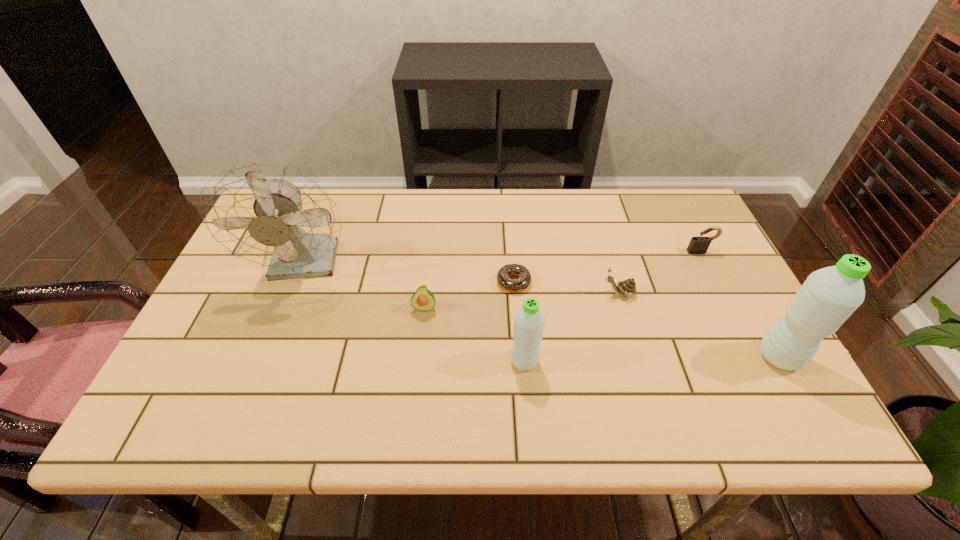
Where is `vacant space that's between the padlock and the snail`? The height and width of the screenshot is (540, 960). vacant space that's between the padlock and the snail is located at coordinates (660, 273).

This screenshot has height=540, width=960. I want to click on empty space between the avocado and the padlock, so click(x=563, y=280).

Find the location of `free space that is in between the leftmost object and the left water bottle`. free space that is in between the leftmost object and the left water bottle is located at coordinates (416, 313).

The height and width of the screenshot is (540, 960). Find the location of `free point between the padlock and the fifth shortest object`. free point between the padlock and the fifth shortest object is located at coordinates (612, 307).

Image resolution: width=960 pixels, height=540 pixels. Find the location of `empty location between the avocado and the left water bottle`. empty location between the avocado and the left water bottle is located at coordinates (474, 335).

You are a GUI agent. You are given a task and a screenshot of the screen. Output one action in this format:
    pyautogui.click(x=<x>, y=<y>)
    Task: Click on the vacant area that lies between the fifth farthest object and the left water bottle
    The width and height of the screenshot is (960, 540).
    Given the screenshot: What is the action you would take?
    pyautogui.click(x=474, y=335)

I want to click on vacant space in between the avocado and the padlock, so click(563, 280).

Where is `object that ranks as the third closest to the padlock`? The height and width of the screenshot is (540, 960). object that ranks as the third closest to the padlock is located at coordinates (523, 282).

Identify which object is the sixth nearest to the taller water bottle. Please provide its 2D coordinates. Your answer should be formatted as a tuple, i.e. [(x, y)], where the tuple contains the x and y coordinates of a point satisfying the conditions above.

[(270, 216)]

The width and height of the screenshot is (960, 540). In order to click on vacant position in the image that satisfies the following two spatial constraints: 1. in front of the fan to blow air; 2. on the right side of the sixth shortest object in this screenshot , I will do `click(271, 357)`.